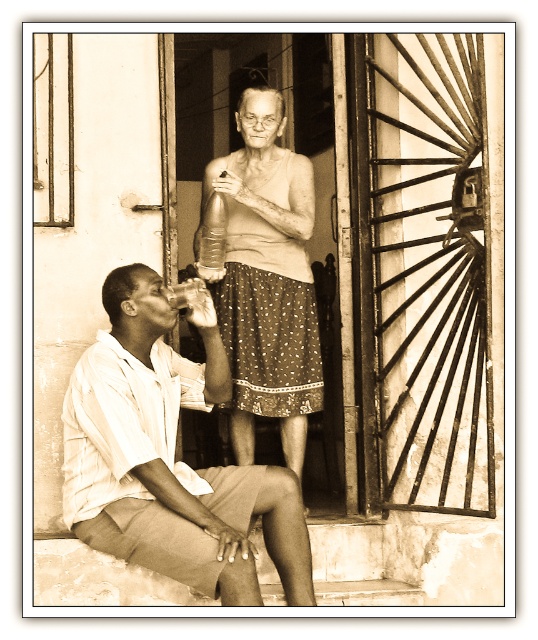
Between white cotton shirt at lower left and translucent glass drink at center, which one is positioned lower?

Positioned lower is white cotton shirt at lower left.

Does white cotton shirt at lower left have a larger size compared to translucent glass drink at center?

Correct, white cotton shirt at lower left is larger in size than translucent glass drink at center.

The width and height of the screenshot is (538, 640). I want to click on white cotton shirt at lower left, so click(169, 458).

This screenshot has width=538, height=640. Describe the element at coordinates (169, 458) in the screenshot. I see `white cotton shirt at lower left` at that location.

Locate an element on the screen. The width and height of the screenshot is (538, 640). white cotton shirt at lower left is located at coordinates (169, 458).

Find the location of `white cotton shirt at lower left`. white cotton shirt at lower left is located at coordinates (169, 458).

Which is behind, point (265, 272) or point (192, 291)?

The point (265, 272) is more distant.

Does matte white blouse at center appear over translucent glass drink at center?

Yes.

Between point (303, 333) and point (172, 296), which one is positioned behind?

Point (303, 333)

I want to click on matte white blouse at center, so click(266, 280).